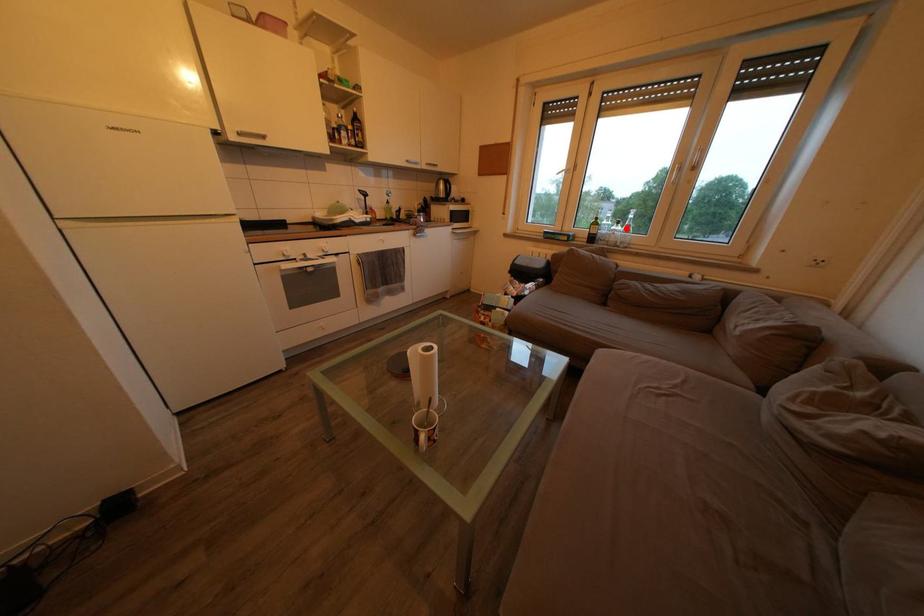
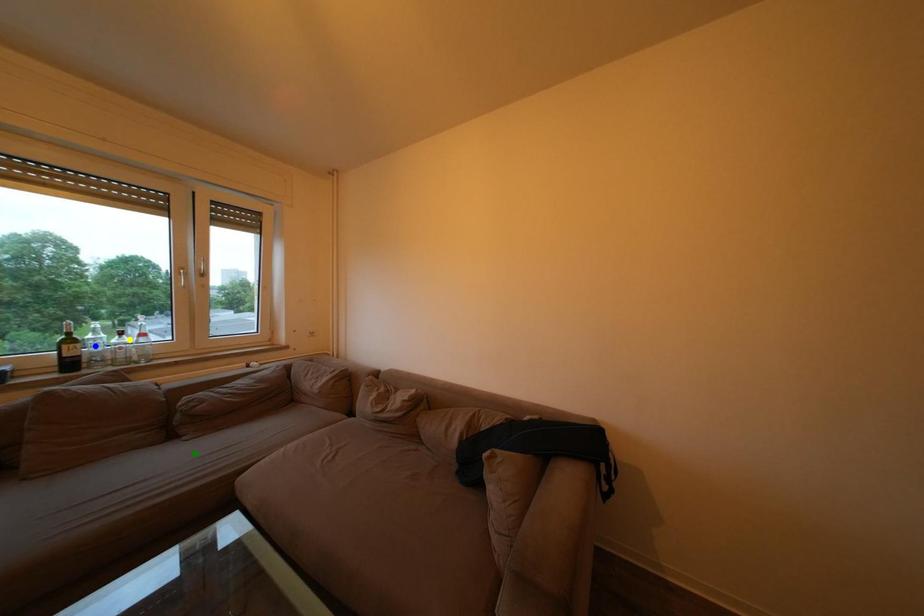
Question: I am providing you with two images of the same scene from different viewpoints. A red point is marked on the first image. You are given multiple points on the second image. Can you choose the point in image 2 that corresponds to the point in image 1?

Choices:
 (A) green point
 (B) yellow point
 (C) blue point

Answer: (B)